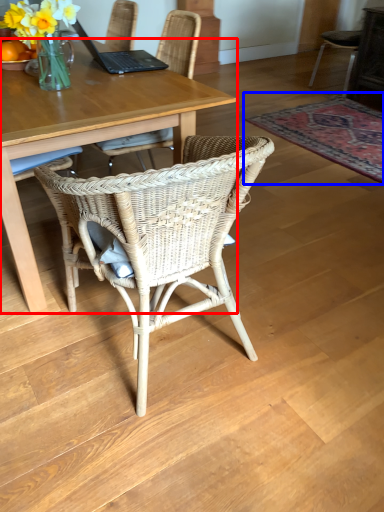
Question: Which object is further to the camera taking this photo, desk (highlighted by a red box) or mat (highlighted by a blue box)?

Choices:
 (A) desk
 (B) mat

Answer: (B)